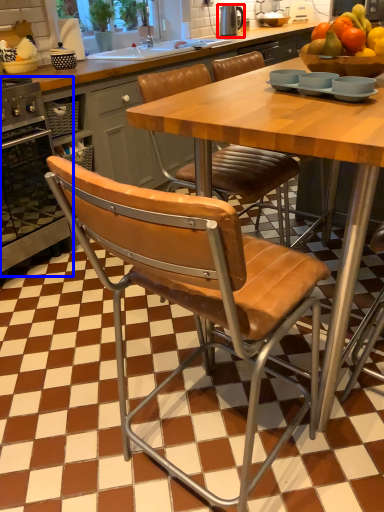
Question: Which object appears farthest to the camera in this image, appliance (highlighted by a red box) or oven (highlighted by a blue box)?

Choices:
 (A) appliance
 (B) oven

Answer: (A)